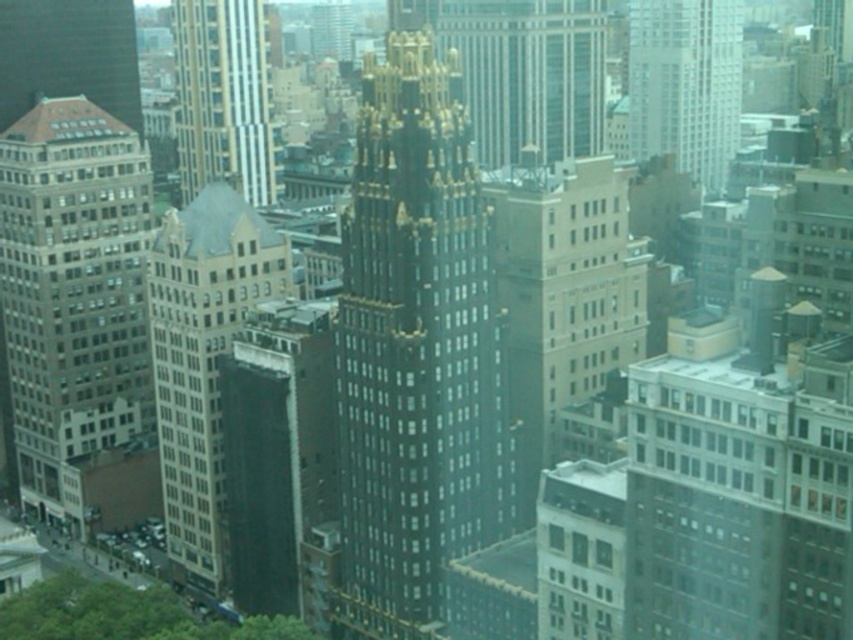
You are standing at the intersection of two streets in the city depicted in the image. You want to locate the shiny gold tower at center. According to the coordinates provided, where should you look relative to your position?

The shiny gold tower at center is located at coordinates point (415, 349), which means it is positioned slightly to the right and above your current line of sight.

You are a city planner analyzing the skyline. Which of the two buildings, the shiny gold tower at center or the matte brown building at upper left, would require more maintenance due to its height?

The shiny gold tower at center is much taller than the matte brown building at upper left, so it would require more maintenance due to its height.

You are standing on the street level of this city scene and looking up at the buildings. Which of the two structures, the shiny gold tower at center or the matte brown building at upper left, is closer to your eye level?

The shiny gold tower at center is closer to your eye level because it is positioned below the matte brown building at upper left, meaning it is lower in the visual field.